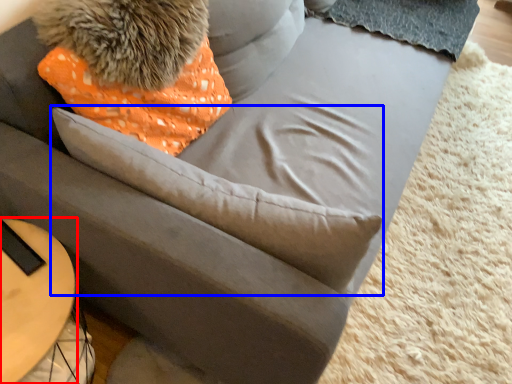
Question: Which object is closer to the camera taking this photo, table (highlighted by a red box) or throw pillow (highlighted by a blue box)?

Choices:
 (A) table
 (B) throw pillow

Answer: (B)